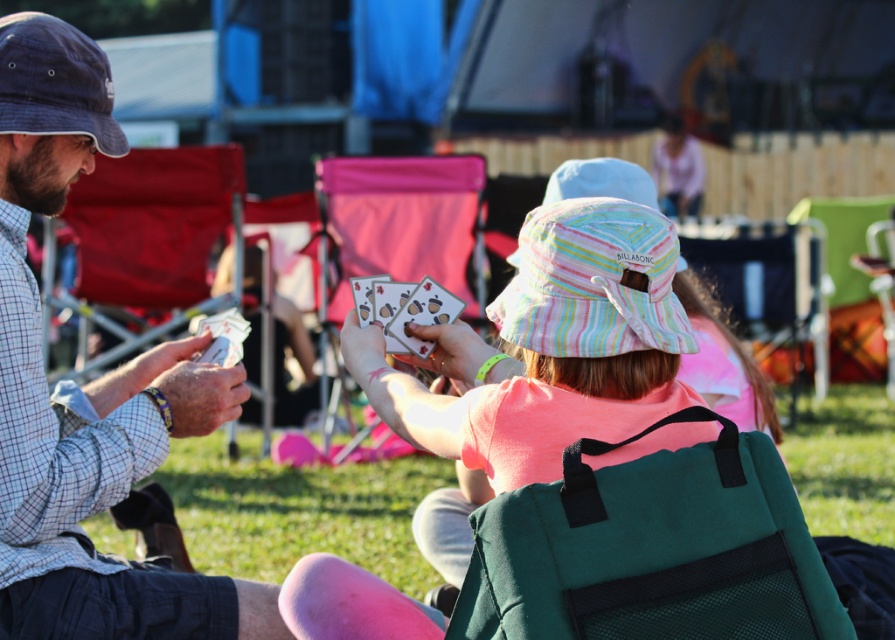
Can you confirm if green grass at lower right is smaller than denim baseball hat at left?

Actually, green grass at lower right might be larger than denim baseball hat at left.

Does green grass at lower right lie in front of denim baseball hat at left?

No, green grass at lower right is behind denim baseball hat at left.

Does point (859, 408) come behind point (96, 44)?

Yes, point (859, 408) is farther from viewer.

At what (x,y) coordinates should I click in order to perform the action: click on green grass at lower right. Please return your answer as a coordinate pair (x, y). The width and height of the screenshot is (895, 640). Looking at the image, I should click on (846, 464).

Between point (586, 368) and point (395, 244), which one is positioned in front?

Point (586, 368) is in front.

Does pink fabric shirt at center appear over pink fabric chair at center?

Incorrect, pink fabric shirt at center is not positioned above pink fabric chair at center.

Where is `pink fabric shirt at center`? pink fabric shirt at center is located at coordinates (550, 348).

Which is below, pink fabric shirt at center or acorn-patterned paper cards at center?

pink fabric shirt at center is lower down.

The height and width of the screenshot is (640, 895). What do you see at coordinates (550, 348) in the screenshot? I see `pink fabric shirt at center` at bounding box center [550, 348].

This screenshot has height=640, width=895. Find the location of `pink fabric shirt at center`. pink fabric shirt at center is located at coordinates (550, 348).